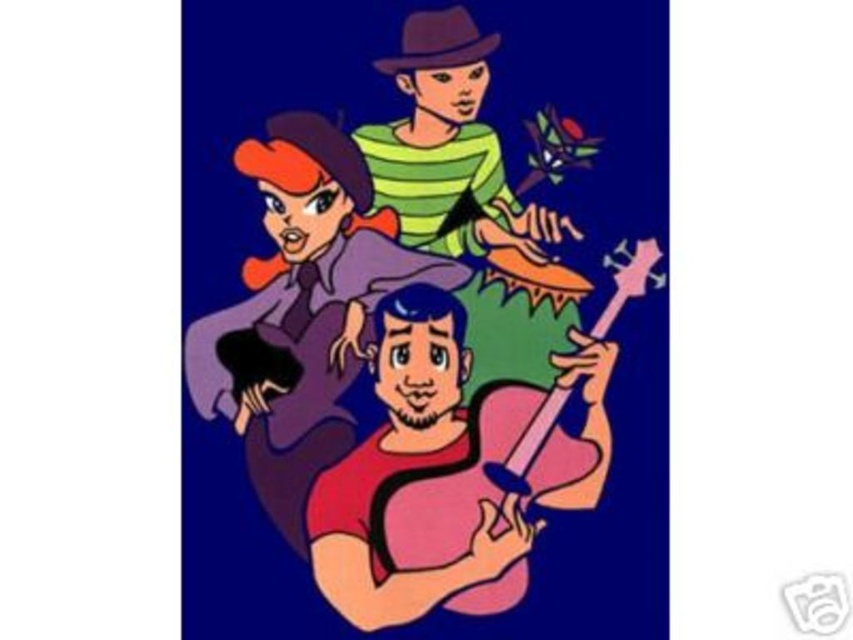
Question: Does smooth purple dress at center have a greater width compared to green striped shirt at upper center?

Choices:
 (A) yes
 (B) no

Answer: (A)

Question: Does pink glossy guitar at center have a lesser width compared to smooth purple dress at center?

Choices:
 (A) yes
 (B) no

Answer: (B)

Question: Can you confirm if pink glossy guitar at center is smaller than green striped shirt at upper center?

Choices:
 (A) yes
 (B) no

Answer: (B)

Question: Based on their relative distances, which object is farther from the green striped shirt at upper center?

Choices:
 (A) pink matte guitar at center
 (B) pink glossy guitar at center
 (C) smooth purple dress at center

Answer: (A)

Question: Among these points, which one is nearest to the camera?

Choices:
 (A) (480, 209)
 (B) (277, 486)
 (C) (347, 508)
 (D) (537, 500)

Answer: (B)

Question: Which of the following is the closest to the observer?

Choices:
 (A) pink matte guitar at center
 (B) green striped shirt at upper center

Answer: (B)